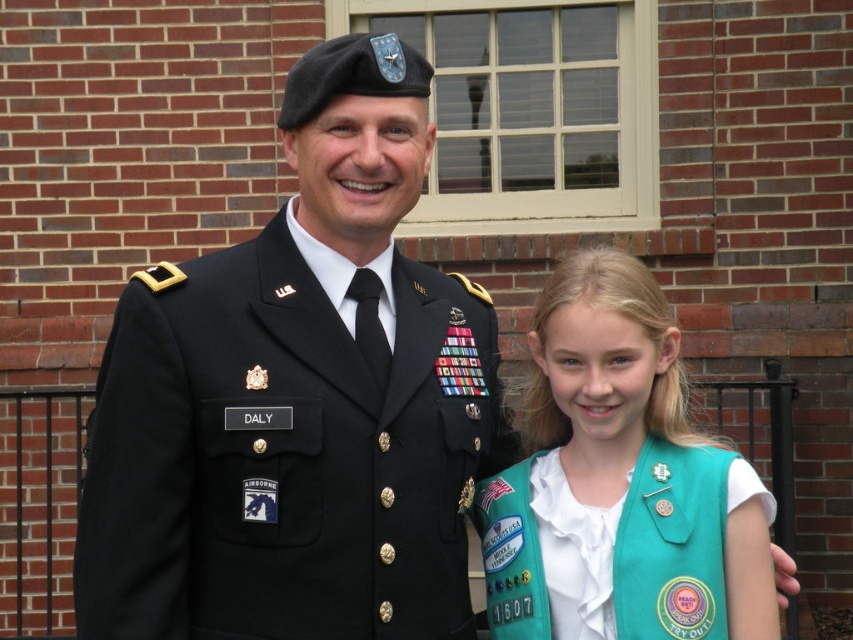
You are a photographer trying to capture the perfect shot of the scene. You notice a specific point in the image at coordinates point (299, 401). Based on the scene description, what object or feature is located at this point?

The point (299, 401) corresponds to the black matte uniform at center, as stated in the Objects Description.

You are a photographer trying to capture a clear photo of both the black matte uniform at center and the teal fabric vest at right. Since you want to focus on the uniform first, which object should you adjust your camera to focus on first, and why?

You should focus on the black matte uniform at center first because it is closer to the viewer than the teal fabric vest at right, allowing for better depth of field when capturing both subjects.

You are a tailor who needs to determine which garment requires more fabric to make between the black matte uniform at center and the teal fabric vest at right. Based on the image, which one would need more fabric?

The black matte uniform at center is bigger than the teal fabric vest at right, so it would require more fabric to make.